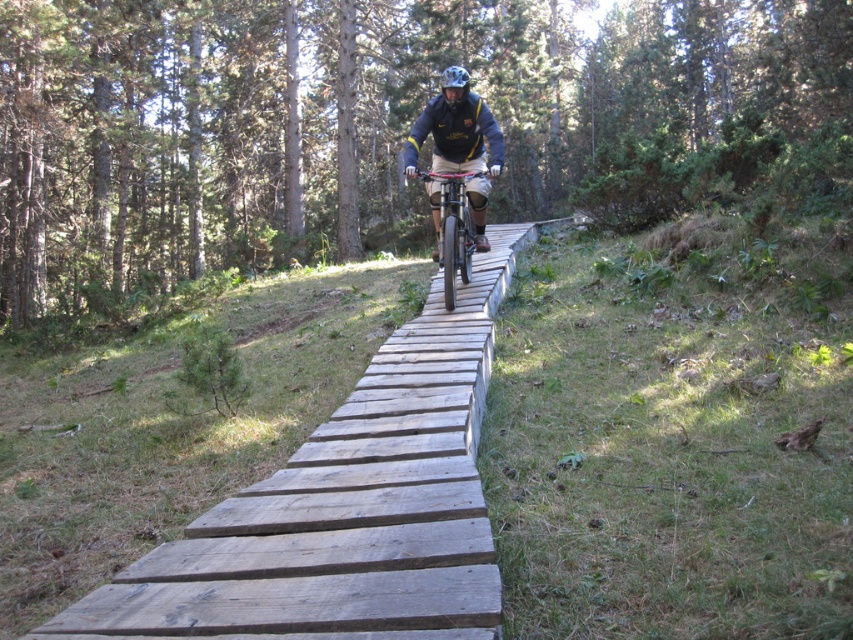
Does weathered wood planks at center appear on the right side of matte white helmet at center?

In fact, weathered wood planks at center is to the left of matte white helmet at center.

Can you confirm if weathered wood planks at center is positioned below matte white helmet at center?

Correct, weathered wood planks at center is located below matte white helmet at center.

Identify the location of weathered wood planks at center. This screenshot has width=853, height=640. (346, 508).

Where is `weathered wood planks at center`? This screenshot has width=853, height=640. weathered wood planks at center is located at coordinates (346, 508).

Does matte black helmet at center have a greater width compared to matte white helmet at center?

No.

Where is `matte black helmet at center`? The height and width of the screenshot is (640, 853). matte black helmet at center is located at coordinates (459, 147).

Image resolution: width=853 pixels, height=640 pixels. In order to click on matte black helmet at center in this screenshot , I will do `click(459, 147)`.

This screenshot has width=853, height=640. I want to click on matte black helmet at center, so click(x=459, y=147).

Can you confirm if weathered wood planks at center is bigger than matte black helmet at center?

Yes.

Which is in front, point (201, 609) or point (412, 172)?

Point (201, 609)

This screenshot has height=640, width=853. What are the coordinates of `weathered wood planks at center` in the screenshot? It's located at (346, 508).